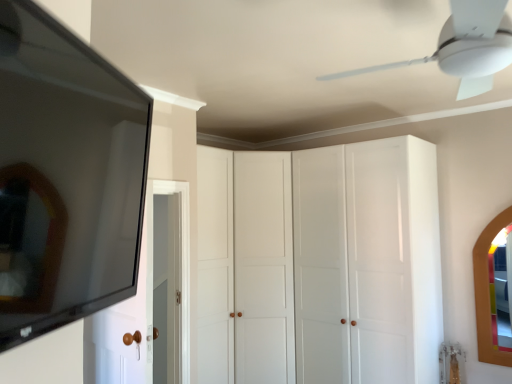
What is the approximate width of matte black mirror at left, acting as the first mirror starting from the left?

3.76 inches.

Describe the element at coordinates (65, 176) in the screenshot. I see `matte black mirror at left, which ranks as the first mirror in top-to-bottom order` at that location.

Describe the element at coordinates (464, 47) in the screenshot. I see `white plastic ceiling fan at upper center` at that location.

Find the location of a particular element. This screenshot has height=384, width=512. wooden-framed mirror at right, which is the first mirror in bottom-to-top order is located at coordinates (487, 292).

Which object is thinner, white glossy cabinet at center or wooden-framed mirror at right, marked as the first mirror in a right-to-left arrangement?

wooden-framed mirror at right, marked as the first mirror in a right-to-left arrangement, is thinner.

Is white glossy cabinet at center shorter than wooden-framed mirror at right, positioned as the 2th mirror in left-to-right order?

No.

Is white glossy cabinet at center positioned with its back to wooden-framed mirror at right, which is the first mirror in bottom-to-top order?

No.

Is white glossy cabinet at center inside the boundaries of matte black mirror at left, the second mirror from the right, or outside?

white glossy cabinet at center lies outside matte black mirror at left, the second mirror from the right.

Identify the location of mirror on the left of white glossy cabinet at center. Image resolution: width=512 pixels, height=384 pixels. (65, 176).

From the image's perspective, between white glossy cabinet at center and matte black mirror at left, which ranks as the first mirror in top-to-bottom order, which one is located above?

From the image's view, matte black mirror at left, which ranks as the first mirror in top-to-bottom order, is above.

Between white glossy cabinet at center and matte black mirror at left, the 2th mirror positioned from the bottom, which one has smaller size?

matte black mirror at left, the 2th mirror positioned from the bottom, is smaller.

Find the location of `door below the matte black mirror at left, arranged as the second mirror when viewed from the back (from a real-world perspective)`. door below the matte black mirror at left, arranged as the second mirror when viewed from the back (from a real-world perspective) is located at coordinates (123, 324).

From the image's perspective, is matte black mirror at left, the first mirror in the front-to-back sequence, located above or below white wood door at left?

matte black mirror at left, the first mirror in the front-to-back sequence, is above white wood door at left.

Is matte black mirror at left, the 2th mirror positioned from the bottom, outside of white wood door at left?

Indeed, matte black mirror at left, the 2th mirror positioned from the bottom, is completely outside white wood door at left.

Does matte black mirror at left, the 2th mirror positioned from the bottom, turn towards white wood door at left?

No, matte black mirror at left, the 2th mirror positioned from the bottom, is not oriented towards white wood door at left.

Looking at this image, is white wood door at left at the back of white glossy cabinet at center?

white glossy cabinet at center is not turned away from white wood door at left.

From the image's perspective, is white glossy cabinet at center above or below white wood door at left?

Based on their image positions, white glossy cabinet at center is located beneath white wood door at left.

Which of these two, white glossy cabinet at center or white wood door at left, is wider?

white glossy cabinet at center is wider.

Does white glossy cabinet at center have a greater height compared to white wood door at left?

Yes, white glossy cabinet at center is taller than white wood door at left.

How much distance is there between white wood door at left and matte black mirror at left, the 2th mirror positioned from the bottom?

white wood door at left is 1.14 meters away from matte black mirror at left, the 2th mirror positioned from the bottom.

Can we say white wood door at left lies outside matte black mirror at left, acting as the first mirror starting from the left?

white wood door at left is positioned outside matte black mirror at left, acting as the first mirror starting from the left.

Which is more to the left, white wood door at left or matte black mirror at left, the second mirror from the right?

white wood door at left is more to the left.

From a real-world perspective, who is located higher, white wood door at left or matte black mirror at left, the first mirror in the front-to-back sequence?

In real-world perspective, matte black mirror at left, the first mirror in the front-to-back sequence, is above.

Can you see white plastic ceiling fan at upper center touching white wood door at left?

There is a gap between white plastic ceiling fan at upper center and white wood door at left.

Is white plastic ceiling fan at upper center facing towards white wood door at left?

No, white plastic ceiling fan at upper center is not oriented towards white wood door at left.

Which object is wider, white plastic ceiling fan at upper center or white wood door at left?

Wider between the two is white plastic ceiling fan at upper center.

The image size is (512, 384). What are the coordinates of `ceiling fan in front of the white wood door at left` in the screenshot? It's located at (464, 47).

Is white plastic ceiling fan at upper center outside of wooden-framed mirror at right, which appears as the second mirror when viewed from the top?

Absolutely, white plastic ceiling fan at upper center is external to wooden-framed mirror at right, which appears as the second mirror when viewed from the top.

Considering the relative positions of white plastic ceiling fan at upper center and wooden-framed mirror at right, positioned as the 2th mirror in left-to-right order, in the image provided, is white plastic ceiling fan at upper center to the left of wooden-framed mirror at right, positioned as the 2th mirror in left-to-right order, from the viewer's perspective?

Indeed, white plastic ceiling fan at upper center is positioned on the left side of wooden-framed mirror at right, positioned as the 2th mirror in left-to-right order.

Considering the points (446, 56) and (478, 263), which point is behind, point (446, 56) or point (478, 263)?

Point (478, 263)

From the image's perspective, which object appears higher, white plastic ceiling fan at upper center or wooden-framed mirror at right, positioned as the 2th mirror in left-to-right order?

white plastic ceiling fan at upper center.

From the image's perspective, starting from the white glossy cabinet at center, which mirror is the 1st one above? Please provide its 2D coordinates.

[(487, 292)]

Image resolution: width=512 pixels, height=384 pixels. I want to click on mirror that is above the white glossy cabinet at center (from a real-world perspective), so click(65, 176).

When comparing their distances from matte black mirror at left, arranged as the second mirror when viewed from the back, does white plastic ceiling fan at upper center or white wood door at left seem closer?

white plastic ceiling fan at upper center is closer to matte black mirror at left, arranged as the second mirror when viewed from the back.

When comparing their distances from matte black mirror at left, the second mirror from the right, does wooden-framed mirror at right, which is the first mirror in bottom-to-top order, or white wood door at left seem further?

wooden-framed mirror at right, which is the first mirror in bottom-to-top order, is positioned further to the anchor matte black mirror at left, the second mirror from the right.

Based on their spatial positions, is white plastic ceiling fan at upper center or wooden-framed mirror at right, the first mirror positioned from the back, closer to white wood door at left?

Based on the image, white plastic ceiling fan at upper center appears to be nearer to white wood door at left.

Estimate the real-world distances between objects in this image. Which object is further from white plastic ceiling fan at upper center, white glossy cabinet at center or wooden-framed mirror at right, the 2th mirror viewed from the front?

Based on the image, wooden-framed mirror at right, the 2th mirror viewed from the front, appears to be further to white plastic ceiling fan at upper center.

When comparing their distances from white glossy cabinet at center, does matte black mirror at left, the first mirror in the front-to-back sequence, or white wood door at left seem further?

matte black mirror at left, the first mirror in the front-to-back sequence.

Estimate the real-world distances between objects in this image. Which object is closer to white wood door at left, wooden-framed mirror at right, which appears as the second mirror when viewed from the top, or white glossy cabinet at center?

white glossy cabinet at center is closer to white wood door at left.

Looking at the image, which one is located further to white glossy cabinet at center, matte black mirror at left, the 2th mirror positioned from the bottom, or wooden-framed mirror at right, which is the first mirror in bottom-to-top order?

Based on the image, matte black mirror at left, the 2th mirror positioned from the bottom, appears to be further to white glossy cabinet at center.

Which object lies nearer to the anchor point matte black mirror at left, which ranks as the first mirror in top-to-bottom order, wooden-framed mirror at right, which is the first mirror in bottom-to-top order, or white glossy cabinet at center?

white glossy cabinet at center is closer to matte black mirror at left, which ranks as the first mirror in top-to-bottom order.

This screenshot has height=384, width=512. Identify the location of mirror situated between white wood door at left and white plastic ceiling fan at upper center from left to right. (65, 176).

You are a GUI agent. You are given a task and a screenshot of the screen. Output one action in this format:
    pyautogui.click(x=<x>, y=<y>)
    Task: Click on the glass door situated between white wood door at left and wooden-framed mirror at right, marked as the first mirror in a right-to-left arrangement, from left to right
    The width and height of the screenshot is (512, 384).
    Given the screenshot: What is the action you would take?
    pyautogui.click(x=352, y=264)

At what (x,y) coordinates should I click in order to perform the action: click on glass door between white plastic ceiling fan at upper center and wooden-framed mirror at right, marked as the first mirror in a right-to-left arrangement, in the front-back direction. Please return your answer as a coordinate pair (x, y). This screenshot has height=384, width=512. Looking at the image, I should click on (352, 264).

Image resolution: width=512 pixels, height=384 pixels. I want to click on glass door located between matte black mirror at left, acting as the first mirror starting from the left, and wooden-framed mirror at right, the 2th mirror viewed from the front, in the depth direction, so click(x=352, y=264).